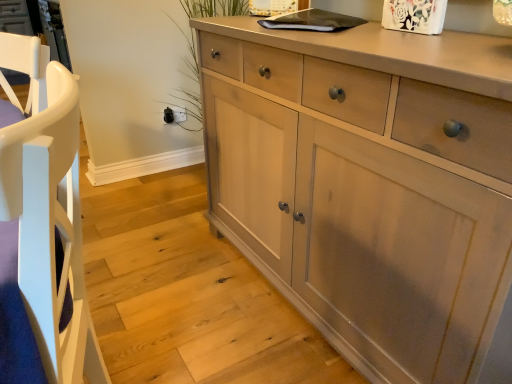
Question: Does matte gray cabinet at lower left lie behind light wood cabinet at center?

Choices:
 (A) no
 (B) yes

Answer: (B)

Question: From the image's perspective, is matte gray cabinet at lower left above light wood cabinet at center?

Choices:
 (A) no
 (B) yes

Answer: (A)

Question: Is matte gray cabinet at lower left located outside light wood cabinet at center?

Choices:
 (A) yes
 (B) no

Answer: (A)

Question: Is matte gray cabinet at lower left positioned with its back to light wood cabinet at center?

Choices:
 (A) yes
 (B) no

Answer: (B)

Question: From a real-world perspective, is matte gray cabinet at lower left on light wood cabinet at center?

Choices:
 (A) yes
 (B) no

Answer: (B)

Question: Does matte gray cabinet at lower left have a greater width compared to light wood cabinet at center?

Choices:
 (A) no
 (B) yes

Answer: (B)

Question: Does light wood cabinet at center have a lesser height compared to matte gray cabinet at lower left?

Choices:
 (A) yes
 (B) no

Answer: (B)

Question: Considering the relative sizes of light wood cabinet at center and matte gray cabinet at lower left in the image provided, is light wood cabinet at center bigger than matte gray cabinet at lower left?

Choices:
 (A) no
 (B) yes

Answer: (B)

Question: Considering the relative sizes of light wood cabinet at center and matte gray cabinet at lower left in the image provided, is light wood cabinet at center thinner than matte gray cabinet at lower left?

Choices:
 (A) yes
 (B) no

Answer: (A)

Question: Is the surface of light wood cabinet at center in direct contact with matte gray cabinet at lower left?

Choices:
 (A) yes
 (B) no

Answer: (B)

Question: Considering the relative positions of light wood cabinet at center and matte gray cabinet at lower left in the image provided, is light wood cabinet at center to the left of matte gray cabinet at lower left from the viewer's perspective?

Choices:
 (A) yes
 (B) no

Answer: (B)

Question: From the image's perspective, does light wood cabinet at center appear higher than matte gray cabinet at lower left?

Choices:
 (A) no
 (B) yes

Answer: (B)

Question: Is matte gray cabinet at lower left facing away from white wood armchair at left?

Choices:
 (A) no
 (B) yes

Answer: (A)